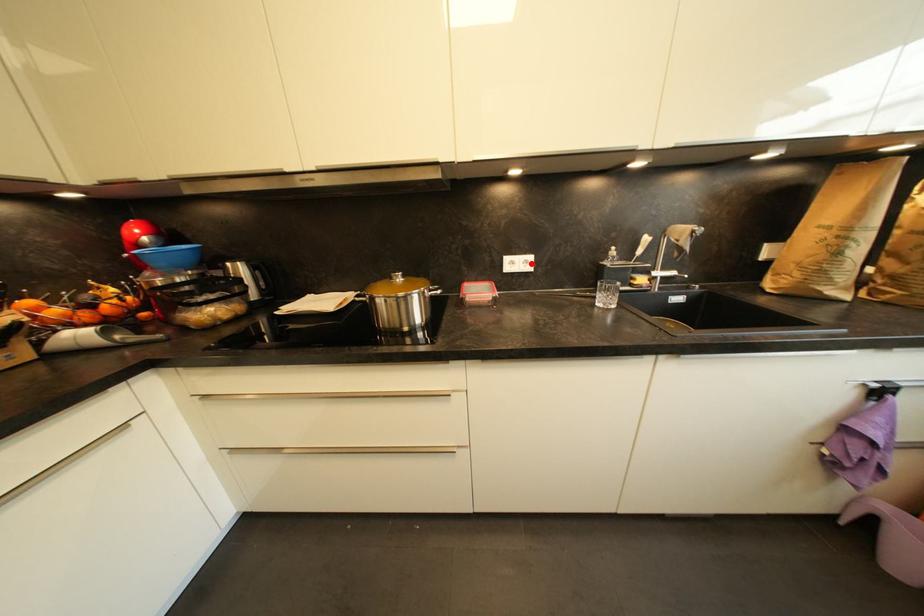
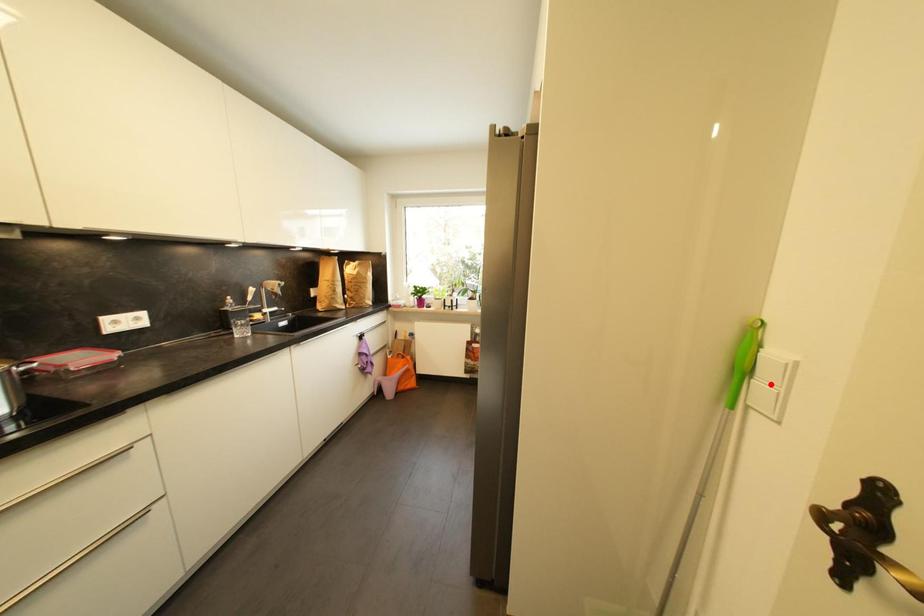
I am providing you with two images of the same scene from different viewpoints. A red point is marked on the first image and another point is marked on the second image. Is the marked point in image1 the same physical position as the marked point in image2?

No